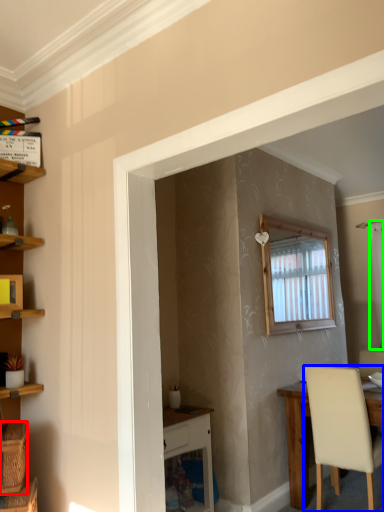
Question: Estimate the real-world distances between objects in this image. Which object is farther from basket (highlighted by a red box), chair (highlighted by a blue box) or curtain (highlighted by a green box)?

Choices:
 (A) chair
 (B) curtain

Answer: (B)